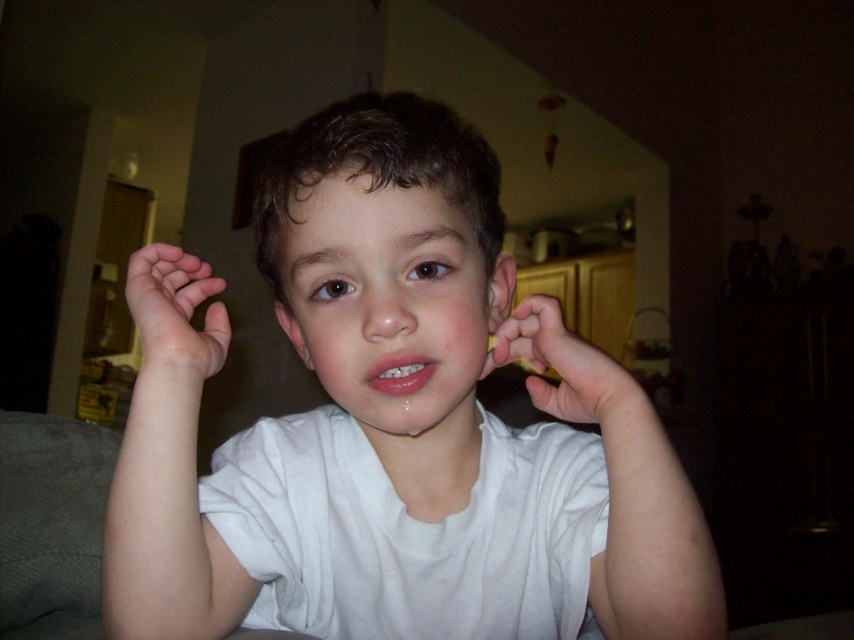
Who is shorter, white cotton shirt at center or white matte hand at center?

white matte hand at center is shorter.

You are a GUI agent. You are given a task and a screenshot of the screen. Output one action in this format:
    pyautogui.click(x=<x>, y=<y>)
    Task: Click on the white cotton shirt at center
    The height and width of the screenshot is (640, 854).
    Given the screenshot: What is the action you would take?
    pyautogui.click(x=407, y=435)

The width and height of the screenshot is (854, 640). I want to click on white cotton shirt at center, so click(x=407, y=435).

Is white cotton shirt at center wider than matte white ear at center?

Yes, white cotton shirt at center is wider than matte white ear at center.

Does white cotton shirt at center have a greater height compared to matte white ear at center?

Yes, white cotton shirt at center is taller than matte white ear at center.

Who is more forward, (x=440, y=540) or (x=288, y=316)?

Point (x=440, y=540) is more forward.

This screenshot has width=854, height=640. Identify the location of white cotton shirt at center. (407, 435).

Which of these two, white matte hand at center or matte white ear at center, stands shorter?

With less height is matte white ear at center.

Which is behind, point (595, 353) or point (297, 353)?

The point (297, 353) is more distant.

At what (x,y) coordinates should I click in order to perform the action: click on white matte hand at center. Please return your answer as a coordinate pair (x, y). Looking at the image, I should click on (566, 369).